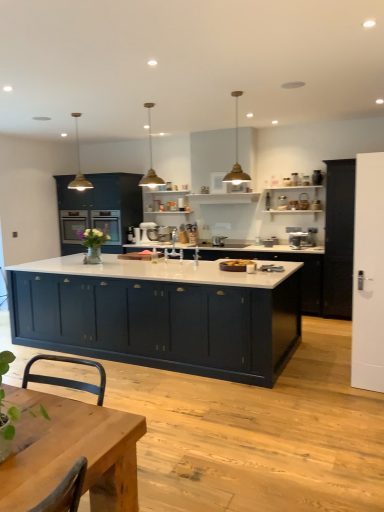
Question: Which direction should I rotate to look at satin silver mixer at center, which is the 1th appliance from front to back?

Choices:
 (A) left
 (B) right

Answer: (A)

Question: Could green leafy plant at lower left be considered to be inside satin silver mixer at center, which ranks as the first appliance in right-to-left order?

Choices:
 (A) yes
 (B) no

Answer: (B)

Question: Does satin silver mixer at center, which is the 1th appliance from front to back, have a greater height compared to green leafy plant at lower left?

Choices:
 (A) no
 (B) yes

Answer: (A)

Question: Can you confirm if satin silver mixer at center, which is the 1th appliance from front to back, is bigger than green leafy plant at lower left?

Choices:
 (A) yes
 (B) no

Answer: (B)

Question: Is satin silver mixer at center, the second appliance in the back-to-front sequence, thinner than green leafy plant at lower left?

Choices:
 (A) no
 (B) yes

Answer: (A)

Question: From the image's perspective, would you say satin silver mixer at center, which is the second appliance from left to right, is positioned over green leafy plant at lower left?

Choices:
 (A) no
 (B) yes

Answer: (B)

Question: Is satin silver mixer at center, which is the second appliance from left to right, beside green leafy plant at lower left?

Choices:
 (A) no
 (B) yes

Answer: (A)

Question: Are matte black cabinet at right, which ranks as the second cabinetry in front-to-back order, and white matte door at right located far from each other?

Choices:
 (A) no
 (B) yes

Answer: (B)

Question: Does matte black cabinet at right, which ranks as the second cabinetry in front-to-back order, have a greater height compared to white matte door at right?

Choices:
 (A) yes
 (B) no

Answer: (A)

Question: Is matte black cabinet at right, which ranks as the second cabinetry in front-to-back order, positioned in front of white matte door at right?

Choices:
 (A) no
 (B) yes

Answer: (A)

Question: Can you confirm if matte black cabinet at right, positioned as the 3th cabinetry in back-to-front order, is wider than white matte door at right?

Choices:
 (A) no
 (B) yes

Answer: (B)

Question: Considering the relative sizes of matte black cabinet at right, positioned as the 3th cabinetry in back-to-front order, and white matte door at right in the image provided, is matte black cabinet at right, positioned as the 3th cabinetry in back-to-front order, thinner than white matte door at right?

Choices:
 (A) no
 (B) yes

Answer: (A)

Question: Is matte black cabinet at right, positioned as the 3th cabinetry in back-to-front order, at the left side of white matte door at right?

Choices:
 (A) no
 (B) yes

Answer: (A)

Question: From the image's perspective, is wooden table at center located above white matte stand mixer at center, the first appliance from the back?

Choices:
 (A) no
 (B) yes

Answer: (A)